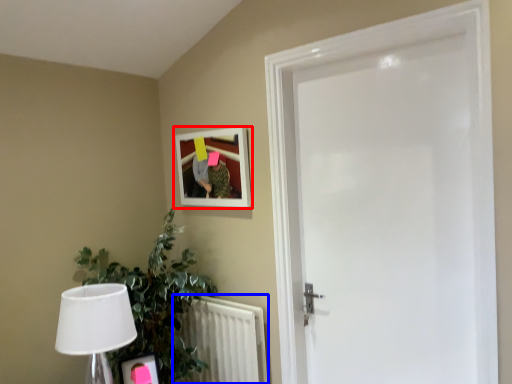
Question: Which of the following is the farthest to the observer, picture frame (highlighted by a red box) or radiator (highlighted by a blue box)?

Choices:
 (A) picture frame
 (B) radiator

Answer: (A)